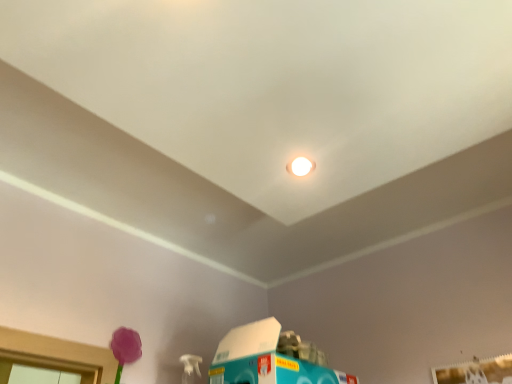
Find the location of a particular element. teal cardboard box at lower right is located at coordinates (265, 360).

This screenshot has width=512, height=384. What do you see at coordinates (265, 360) in the screenshot? I see `teal cardboard box at lower right` at bounding box center [265, 360].

Identify the location of teal cardboard box at lower right. (265, 360).